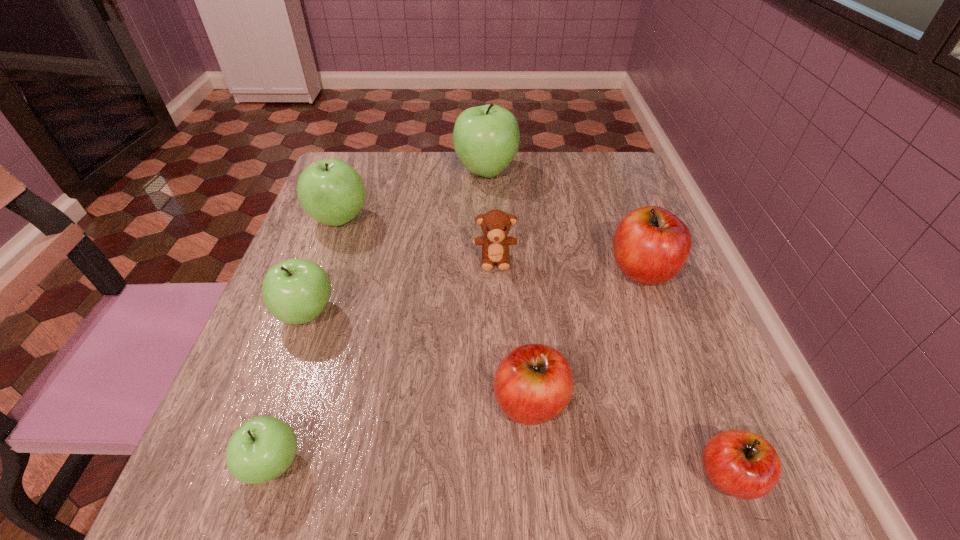
Where is `object present at the near left corner`? The height and width of the screenshot is (540, 960). object present at the near left corner is located at coordinates click(263, 448).

Locate an element on the screen. The height and width of the screenshot is (540, 960). object located in the near right corner section of the desktop is located at coordinates (742, 464).

You are a GUI agent. You are given a task and a screenshot of the screen. Output one action in this format:
    pyautogui.click(x=<x>, y=<y>)
    Task: Click on the free space at the far edge of the desktop
    The image size is (960, 540).
    Given the screenshot: What is the action you would take?
    pyautogui.click(x=438, y=183)

The image size is (960, 540). I want to click on free space at the near edge of the desktop, so click(508, 464).

Locate an element on the screen. Image resolution: width=960 pixels, height=540 pixels. vacant space at the left edge is located at coordinates (327, 235).

The height and width of the screenshot is (540, 960). I want to click on free space at the right edge of the desktop, so click(585, 229).

Where is `vacant space at the far left corner of the desktop`? vacant space at the far left corner of the desktop is located at coordinates (351, 164).

In the image, there is a desktop. Where is `vacant space at the near left corner`? vacant space at the near left corner is located at coordinates (280, 478).

This screenshot has height=540, width=960. Find the location of `free location at the far right corner`. free location at the far right corner is located at coordinates (614, 167).

In the image, there is a desktop. Where is `free space at the near right corner`? Image resolution: width=960 pixels, height=540 pixels. free space at the near right corner is located at coordinates (709, 511).